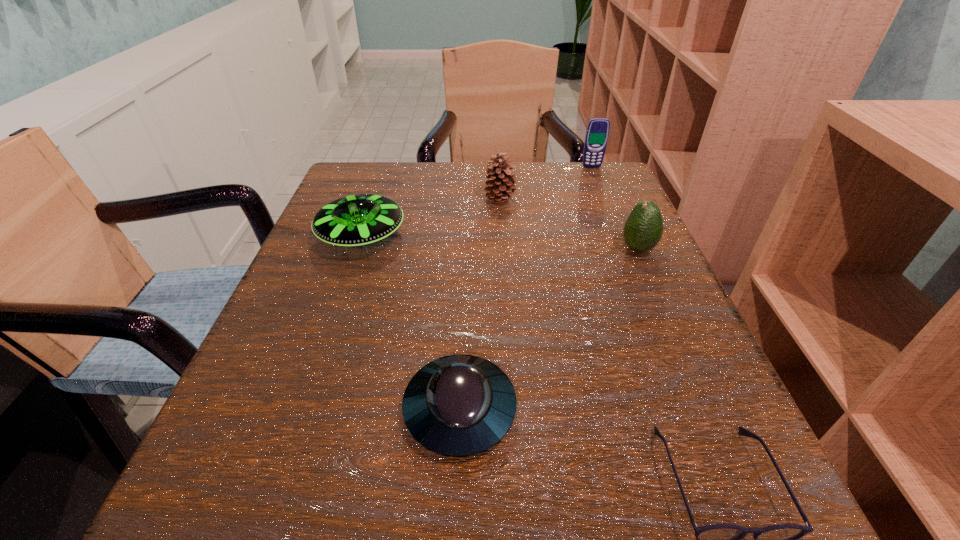
This screenshot has height=540, width=960. I want to click on free spot between the right saucer and the avocado, so click(549, 329).

The width and height of the screenshot is (960, 540). Find the location of `vacant area between the cellular telephone and the leftmost object`. vacant area between the cellular telephone and the leftmost object is located at coordinates (477, 202).

Locate an element on the screen. This screenshot has height=540, width=960. vacant space that is in between the cellular telephone and the pinecone is located at coordinates (545, 183).

Identify the location of free spot between the leftmost object and the right saucer. (411, 324).

Find the location of a particular element. The width and height of the screenshot is (960, 540). empty space that is in between the right saucer and the farther saucer is located at coordinates (411, 324).

Point out which object is positioned as the third nearest to the spectacles. Please provide its 2D coordinates. Your answer should be formatted as a tuple, i.e. [(x, y)], where the tuple contains the x and y coordinates of a point satisfying the conditions above.

[(358, 220)]

I want to click on object that is the closest to the spectacles, so click(x=460, y=405).

Find the location of a particular element. free location that satisfies the following two spatial constraints: 1. on the front side of the nearer saucer; 2. on the left side of the fourth tallest object is located at coordinates (302, 410).